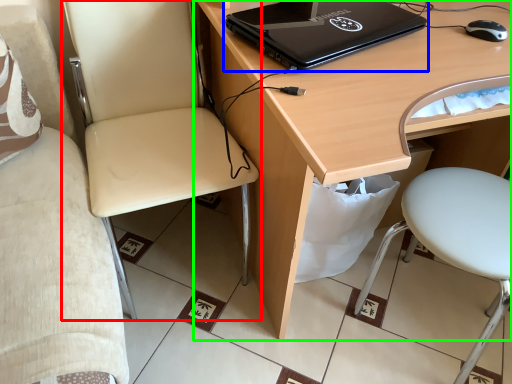
Question: Estimate the real-world distances between objects in this image. Which object is closer to chair (highlighted by a red box), laptop (highlighted by a blue box) or desk (highlighted by a green box)?

Choices:
 (A) laptop
 (B) desk

Answer: (B)